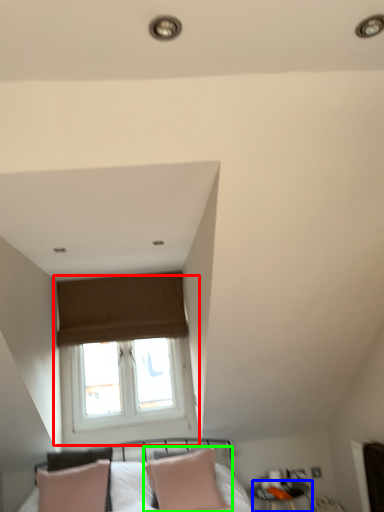
Question: Based on their relative distances, which object is farther from window (highlighted by a red box)? Choose from side table (highlighted by a blue box) and pillow (highlighted by a green box).

Choices:
 (A) side table
 (B) pillow

Answer: (A)